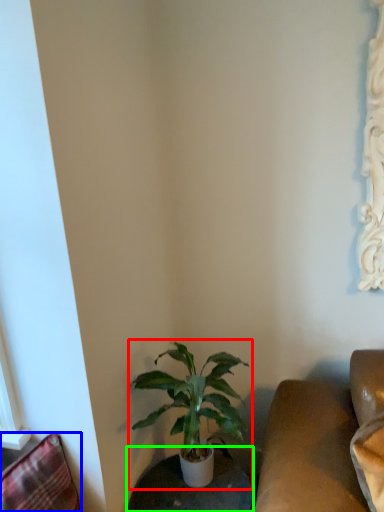
Question: Which object is positioned closest to houseplant (highlighted by a red box)? Select from swivel chair (highlighted by a blue box) and round table (highlighted by a green box).

Choices:
 (A) swivel chair
 (B) round table

Answer: (B)